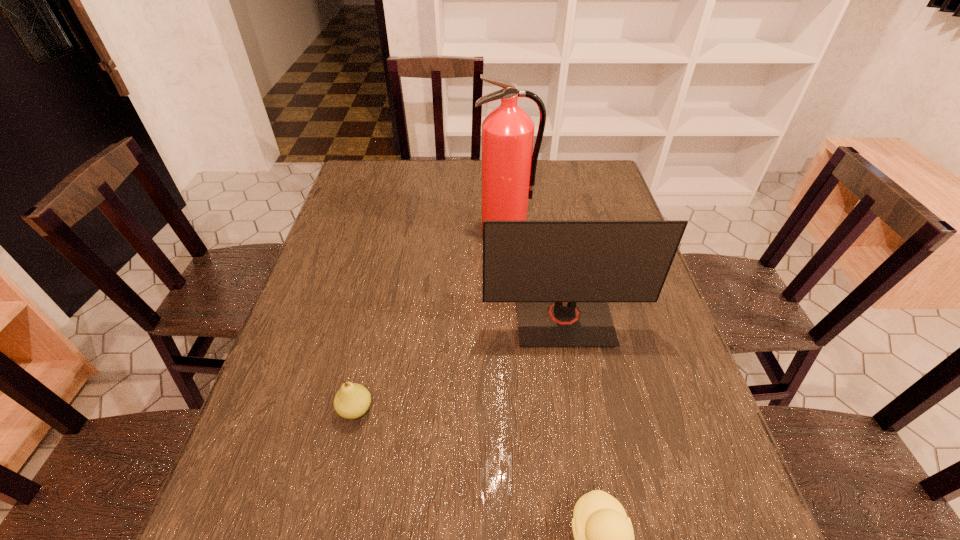
In the image, there is a desktop. Identify the location of vacant region at the far edge. This screenshot has height=540, width=960. (456, 177).

The width and height of the screenshot is (960, 540). I want to click on vacant space at the near edge of the desktop, so click(x=441, y=536).

Where is `vacant space at the left edge of the desktop`? vacant space at the left edge of the desktop is located at coordinates (298, 404).

What are the coordinates of `vacant region at the far left corner of the desktop` in the screenshot? It's located at (372, 172).

Locate an element on the screen. Image resolution: width=960 pixels, height=540 pixels. vacant space at the far right corner of the desktop is located at coordinates [598, 159].

Locate an element on the screen. free space between the farthest object and the pear is located at coordinates (431, 319).

Find the location of a particular element. object that is the closest to the duckling is located at coordinates (561, 274).

Locate which object is the closest to the second nearest object. Please provide its 2D coordinates. Your answer should be formatted as a tuple, i.e. [(x, y)], where the tuple contains the x and y coordinates of a point satisfying the conditions above.

[(561, 274)]